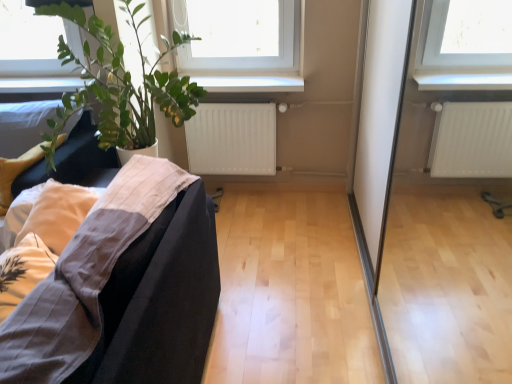
This screenshot has height=384, width=512. What do you see at coordinates (232, 139) in the screenshot?
I see `white matte radiator at center` at bounding box center [232, 139].

You are a GUI agent. You are given a task and a screenshot of the screen. Output one action in this format:
    pyautogui.click(x=<x>, y=<y>)
    Task: Click on the white matte radiator at center
    The width and height of the screenshot is (512, 384).
    Given the screenshot: What is the action you would take?
    pos(232,139)

Identify the location of green leafy plant at left. The image size is (512, 384). (122, 83).

Locate an element on the screen. The image size is (512, 384). black fabric couch at lower left is located at coordinates (160, 299).

From a real-world perspective, is green leafy plant at left positioned above or below transparent glass screen door at lower right?

green leafy plant at left is above transparent glass screen door at lower right.

Based on the photo, between green leafy plant at left and transparent glass screen door at lower right, which one appears on the left side from the viewer's perspective?

green leafy plant at left.

Between point (124, 104) and point (500, 293), which one is positioned in front?

The point (124, 104) is closer.

Is green leafy plant at left far away from transparent glass screen door at lower right?

Yes.

Is point (285, 79) less distant than point (188, 330)?

No, it is not.

Does white glossy window sill at upper center have a lesser height compared to black fabric couch at lower left?

Correct, white glossy window sill at upper center is not as tall as black fabric couch at lower left.

Find the location of a particular element. Image resolution: width=512 pixels, height=384 pixels. couch below the white glossy window sill at upper center (from the image's perspective) is located at coordinates (160, 299).

Is black fabric couch at lower left taller than white glossy window sill at upper center?

Correct, black fabric couch at lower left is much taller as white glossy window sill at upper center.

How many degrees apart are the facing directions of black fabric couch at lower left and white glossy window sill at upper center?

There is a 89.6-degree angle between the facing directions of black fabric couch at lower left and white glossy window sill at upper center.

Where is `couch on the left of white glossy window sill at upper center`? Image resolution: width=512 pixels, height=384 pixels. couch on the left of white glossy window sill at upper center is located at coordinates [x=160, y=299].

Considering the relative sizes of black fabric couch at lower left and white glossy window sill at upper center in the image provided, is black fabric couch at lower left thinner than white glossy window sill at upper center?

No, black fabric couch at lower left is not thinner than white glossy window sill at upper center.

Considering their positions, is white matte radiator at center located in front of or behind green leafy plant at left?

In the image, white matte radiator at center appears behind green leafy plant at left.

Who is taller, white matte radiator at center or green leafy plant at left?

green leafy plant at left.

Is white matte radiator at center far away from green leafy plant at left?

white matte radiator at center is actually quite close to green leafy plant at left.

Considering the points (268, 125) and (125, 121), which point is behind, point (268, 125) or point (125, 121)?

The point (268, 125) is behind.

Considering the relative sizes of green leafy plant at left and white glossy window sill at upper center in the image provided, is green leafy plant at left bigger than white glossy window sill at upper center?

Correct, green leafy plant at left is larger in size than white glossy window sill at upper center.

Based on the photo, would you say white glossy window sill at upper center is part of green leafy plant at left's contents?

No, white glossy window sill at upper center is located outside of green leafy plant at left.

Is green leafy plant at left looking in the opposite direction of white glossy window sill at upper center?

green leafy plant at left is not turned away from white glossy window sill at upper center.

From the image's perspective, does green leafy plant at left appear higher than white glossy window sill at upper center?

Actually, green leafy plant at left appears below white glossy window sill at upper center in the image.

Considering the sizes of objects green leafy plant at left and white matte radiator at center in the image provided, who is taller, green leafy plant at left or white matte radiator at center?

green leafy plant at left.

Is green leafy plant at left not close to white matte radiator at center?

No, there isn't a large distance between green leafy plant at left and white matte radiator at center.

From the image's perspective, relative to white matte radiator at center, is green leafy plant at left above or below?

green leafy plant at left is situated higher than white matte radiator at center in the image.

From the image's perspective, relative to white glossy window sill at upper center, is white matte radiator at center above or below?

From the image's perspective, white matte radiator at center appears below white glossy window sill at upper center.

How much distance is there between white matte radiator at center and white glossy window sill at upper center?

11.41 inches.

Can you tell me how much white matte radiator at center and white glossy window sill at upper center differ in facing direction?

There is a 0.246-degree angle between the facing directions of white matte radiator at center and white glossy window sill at upper center.

Between white matte radiator at center and white glossy window sill at upper center, which one has larger size?

white matte radiator at center.

Where is `screen door in front of the green leafy plant at left`? This screenshot has height=384, width=512. screen door in front of the green leafy plant at left is located at coordinates (446, 243).

Identify the location of couch that appears below the white glossy window sill at upper center (from a real-world perspective). (160, 299).

From the image, which object appears to be farther from green leafy plant at left, white matte radiator at center or black fabric couch at lower left?

black fabric couch at lower left lies further to green leafy plant at left than the other object.

Which object lies nearer to the anchor point black fabric couch at lower left, white glossy window sill at upper center or green leafy plant at left?

Based on the image, green leafy plant at left appears to be nearer to black fabric couch at lower left.

Considering their positions, is green leafy plant at left positioned closer to white glossy window sill at upper center than transparent glass screen door at lower right?

green leafy plant at left.

Estimate the real-world distances between objects in this image. Which object is closer to white matte radiator at center, transparent glass screen door at lower right or black fabric couch at lower left?

transparent glass screen door at lower right lies closer to white matte radiator at center than the other object.

Which object lies nearer to the anchor point green leafy plant at left, white glossy window sill at upper center or transparent glass screen door at lower right?

white glossy window sill at upper center is positioned closer to the anchor green leafy plant at left.

Based on the photo, estimate the real-world distances between objects in this image. Which object is closer to white matte radiator at center, transparent glass screen door at lower right or green leafy plant at left?

Among the two, green leafy plant at left is located nearer to white matte radiator at center.

When comparing their distances from black fabric couch at lower left, does green leafy plant at left or white glossy window sill at upper center seem further?

Among the two, white glossy window sill at upper center is located further to black fabric couch at lower left.

Which object lies nearer to the anchor point transparent glass screen door at lower right, black fabric couch at lower left or white glossy window sill at upper center?

The object closer to transparent glass screen door at lower right is white glossy window sill at upper center.

Where is `houseplant between transparent glass screen door at lower right and white glossy window sill at upper center from front to back`? houseplant between transparent glass screen door at lower right and white glossy window sill at upper center from front to back is located at coordinates (122, 83).

Identify the location of houseplant located between black fabric couch at lower left and white matte radiator at center in the depth direction. (122, 83).

Find the location of `houseplant located between black fabric couch at lower left and transparent glass screen door at lower right in the left-right direction`. houseplant located between black fabric couch at lower left and transparent glass screen door at lower right in the left-right direction is located at coordinates (122, 83).

You are a GUI agent. You are given a task and a screenshot of the screen. Output one action in this format:
    pyautogui.click(x=<x>, y=<y>)
    Task: Click on the window sill positioned between green leafy plant at left and white matte radiator at center from near to far
    Image resolution: width=512 pixels, height=384 pixels.
    Given the screenshot: What is the action you would take?
    pyautogui.click(x=250, y=83)